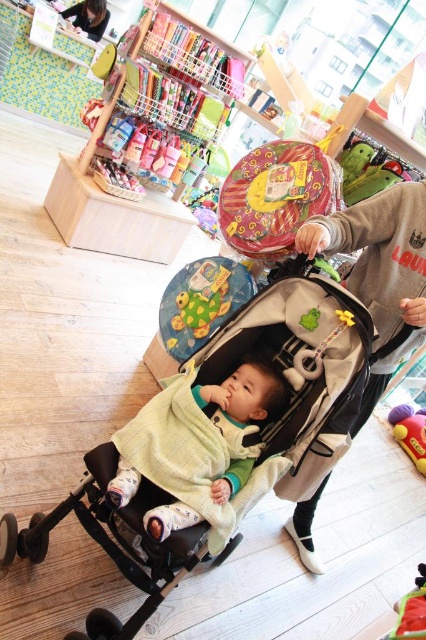
You are a parent standing next to the black fabric baby carriage at center and want to reach a toy placed on a shelf 5 feet away. Can you stretch your arm to grab it without moving your feet?

The distance between you and the shelf is 5 feet, but you are only 4.55 feet away from the black fabric baby carriage at center. Since the carriage is in the way, you might not be able to reach the shelf without moving around it.

You are a customer in the toy store looking for a specific toy. You see the soft green blanket at center and the matte black hair at upper left. Which object is positioned to the right side of the other?

The soft green blanket at center is to the right of the matte black hair at upper left.

You are a parent trying to cover your child with a soft green blanket at center while holding onto the matte black hair at upper left. Can you reach both objects at the same time?

The soft green blanket at center is taller than matte black hair at upper left, so you can reach both objects at the same time.